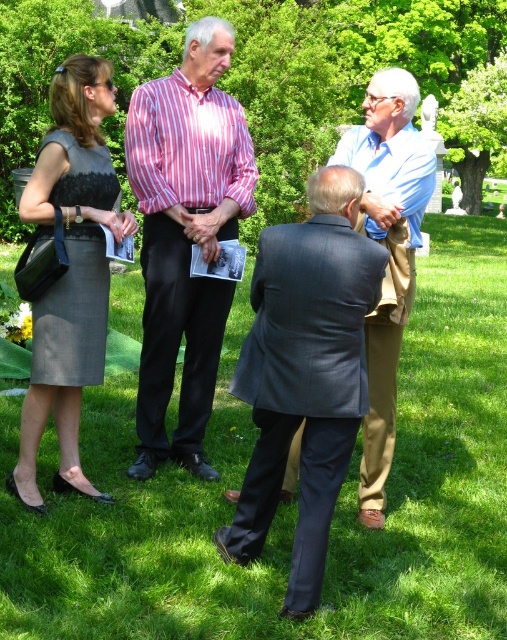
Question: Estimate the real-world distances between objects in this image. Which object is farther from the green grass at lower center?

Choices:
 (A) matte gray dress at left
 (B) light blue shirt at center

Answer: (B)

Question: Is matte gray dress at left thinner than light blue shirt at center?

Choices:
 (A) no
 (B) yes

Answer: (A)

Question: Which of the following is the farthest from the observer?

Choices:
 (A) matte gray dress at left
 (B) dark gray suit at center
 (C) striped cotton shirt at center

Answer: (C)

Question: Which point appears closest to the camera in this image?

Choices:
 (A) (23, 216)
 (B) (393, 259)
 (C) (77, 506)

Answer: (A)

Question: Is matte gray dress at left further to the viewer compared to light blue shirt at center?

Choices:
 (A) no
 (B) yes

Answer: (A)

Question: Is green grass at lower center bigger than striped cotton shirt at center?

Choices:
 (A) no
 (B) yes

Answer: (B)